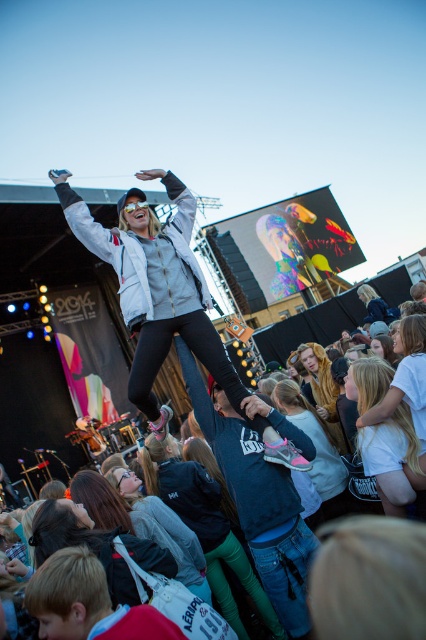
Is white matte shirt at center bigger than matte black jacket at lower center?

Actually, white matte shirt at center might be smaller than matte black jacket at lower center.

Measure the distance between white matte shirt at center and camera.

white matte shirt at center is 12.99 meters from camera.

Which is in front, point (394, 467) or point (138, 516)?

Point (138, 516) is in front.

Identify the location of white matte shirt at center. (391, 458).

Does white matte jacket at center have a greater height compared to dark blue jeans at center?

Correct, white matte jacket at center is much taller as dark blue jeans at center.

Is white matte jacket at center shorter than dark blue jeans at center?

No.

Between point (192, 202) and point (233, 416), which one is positioned in front?

Point (192, 202) is in front.

Find the location of a particular element. white matte jacket at center is located at coordinates (155, 288).

Can you confirm if dark blue jeans at center is positioned to the right of fluffy brown bear at center?

No, dark blue jeans at center is not to the right of fluffy brown bear at center.

I want to click on dark blue jeans at center, so click(x=258, y=499).

Find the location of a particular element. The height and width of the screenshot is (640, 426). dark blue jeans at center is located at coordinates (258, 499).